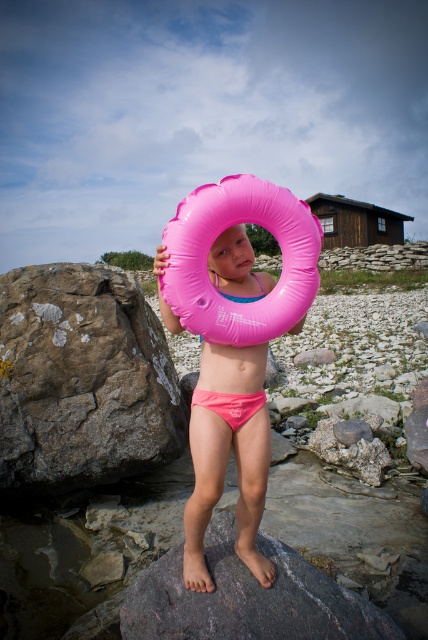
You are a drone operator trying to capture aerial footage of the rocky terrain. You notice two points marked at coordinates point [24,454] and point [256,458]. If you want to film the area behind the closer point, which coordinate should you focus on?

Point [24,454] is behind point [256,458], so to film the area behind the closer point, you should focus on point [256,458] since it is in front and its behind area would be visible.

Based on the photo, you are a photographer setting up a shot of the gray rough rock at left and the pink rubber ring at center. Which object should you focus on first if you want to capture both in a single frame without moving the camera?

You should focus on the gray rough rock at left first because it is larger than the pink rubber ring at center, allowing you to ensure it fits well within the frame before adjusting for the smaller object.